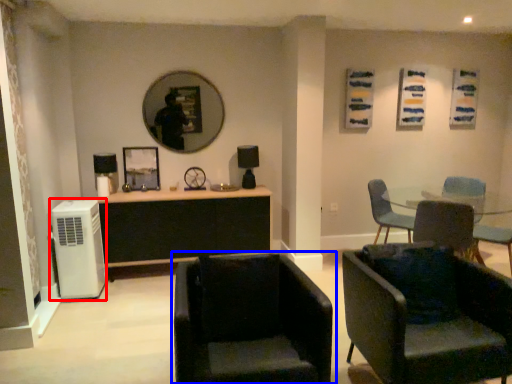
Question: Which object appears farthest to the camera in this image, air conditioning (highlighted by a red box) or chair (highlighted by a blue box)?

Choices:
 (A) air conditioning
 (B) chair

Answer: (A)